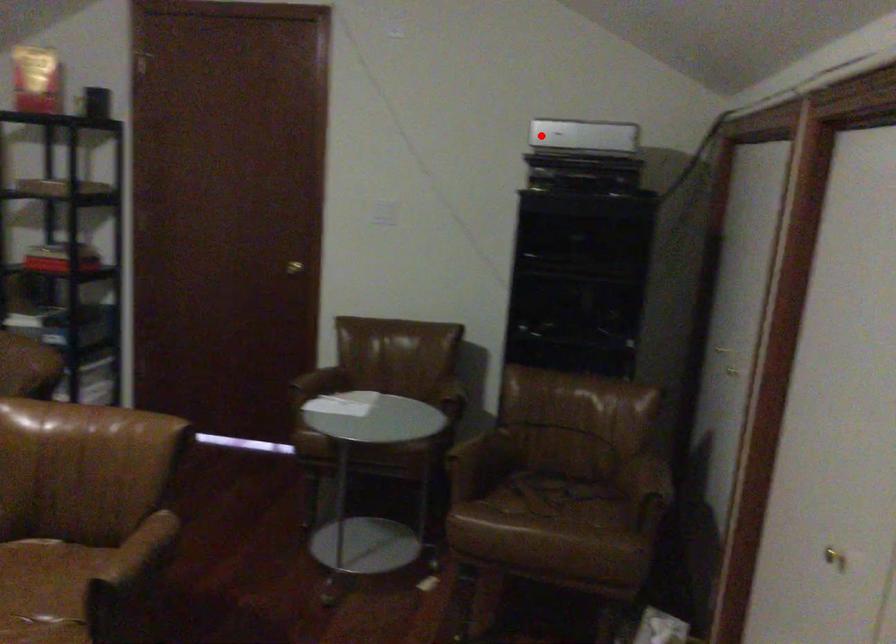
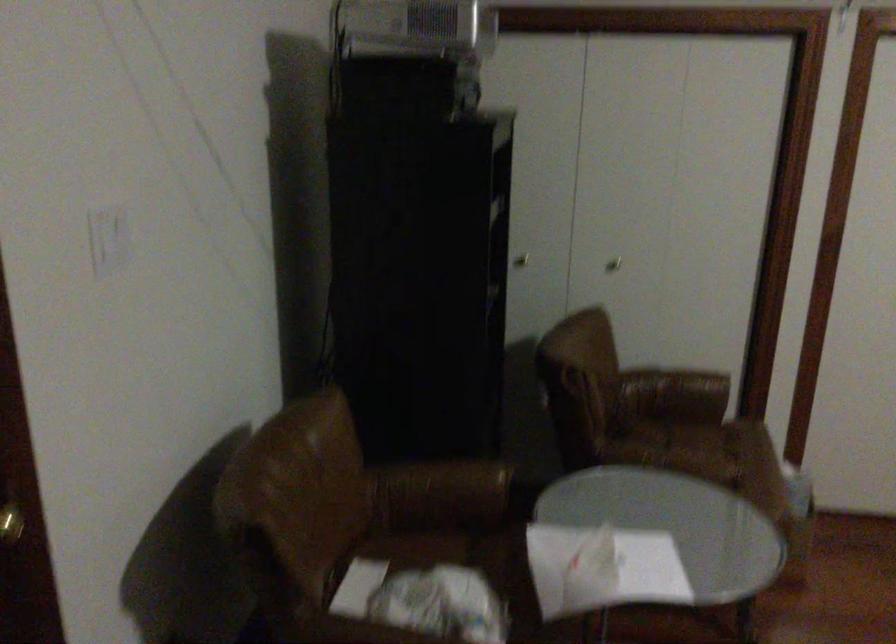
Question: A red point is marked in image1. In image2, is the corresponding 3D point closer to the camera or farther? Reply with the corresponding letter.

Choices:
 (A) The corresponding 3D point is closer.
 (B) The corresponding 3D point is farther.

Answer: (A)